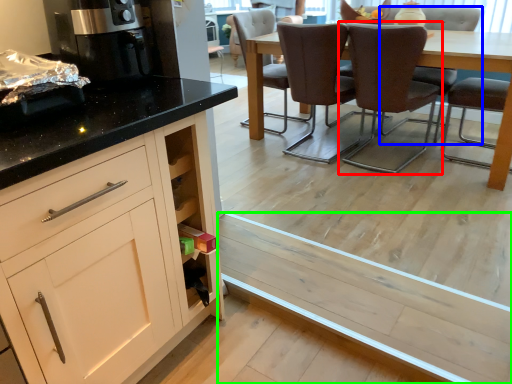
Question: Considering the real-world distances, which object is closest to chair (highlighted by a red box)? chair (highlighted by a blue box) or plank (highlighted by a green box).

Choices:
 (A) chair
 (B) plank

Answer: (A)